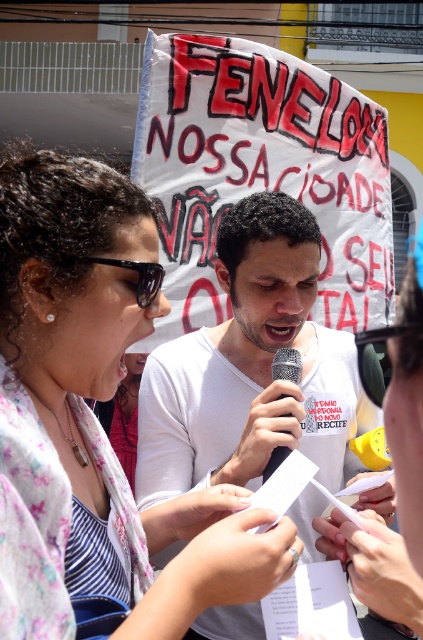
You are a photographer at this event and want to capture both the matte white scarf at upper left and the white matte shirt at center in a single frame. Which object should you focus on first to ensure both are in the frame?

The matte white scarf at upper left is shorter than the white matte shirt at center, so you should focus on the white matte shirt at center first to ensure both are in the frame.

You are a photographer positioned at the center of the scene. You want to capture a photo that includes both the matte white scarf at upper left and the metallic silver microphone at center. What is the minimum distance you need to move backward to ensure both objects are in frame?

The matte white scarf at upper left is 1.33 meters from the metallic silver microphone at center. To include both in the frame, you need to move backward at least 1.33 meters from the microphone to ensure both objects are within the camera view.

You are a photographer trying to capture a clear shot of the white matte shirt at center and the metallic silver microphone at center. Which object should you zoom in on to ensure both are in focus without changing your position?

The white matte shirt at center has a larger size compared to the metallic silver microphone at center, so you should zoom in on the smaller metallic silver microphone at center to ensure both are in focus without changing your position.